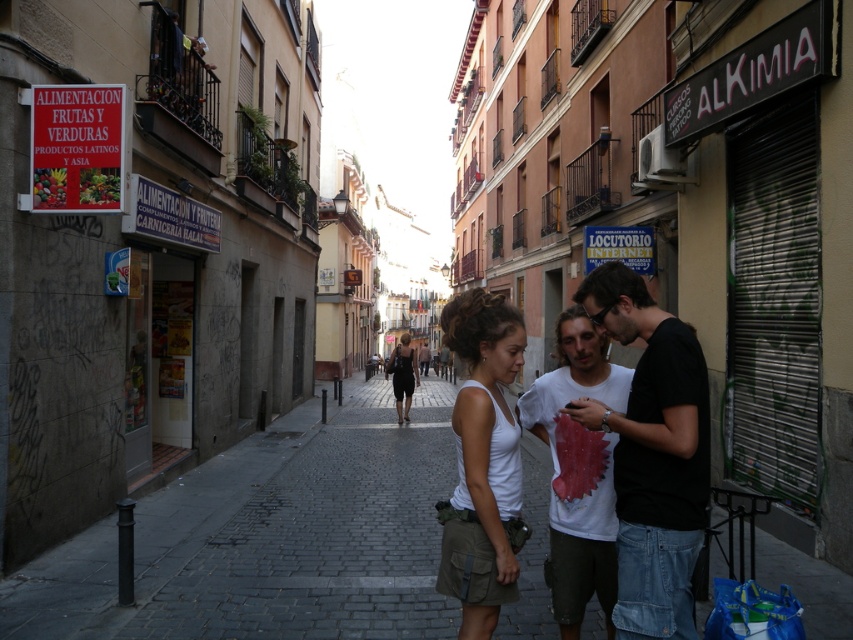
Is dark gray cobblestone at center wider than black matte shirt at center?

Correct, the width of dark gray cobblestone at center exceeds that of black matte shirt at center.

Find the location of a particular element. Image resolution: width=853 pixels, height=640 pixels. dark gray cobblestone at center is located at coordinates (270, 538).

The height and width of the screenshot is (640, 853). I want to click on dark gray cobblestone at center, so click(270, 538).

Does black matte shirt at center appear under white cotton t-shirt at center?

No.

Does black matte shirt at center have a lesser width compared to white cotton t-shirt at center?

Correct, black matte shirt at center's width is less than white cotton t-shirt at center's.

Is point (685, 538) less distant than point (614, 525)?

Yes, point (685, 538) is closer to viewer.

Find the location of a particular element. black matte shirt at center is located at coordinates (653, 454).

Which of these two, black matte shirt at center or white cotton tank top at center, stands taller?

white cotton tank top at center

What do you see at coordinates (653, 454) in the screenshot? I see `black matte shirt at center` at bounding box center [653, 454].

What do you see at coordinates (653, 454) in the screenshot? The width and height of the screenshot is (853, 640). I see `black matte shirt at center` at bounding box center [653, 454].

At what (x,y) coordinates should I click in order to perform the action: click on black matte shirt at center. Please return your answer as a coordinate pair (x, y). The height and width of the screenshot is (640, 853). Looking at the image, I should click on (653, 454).